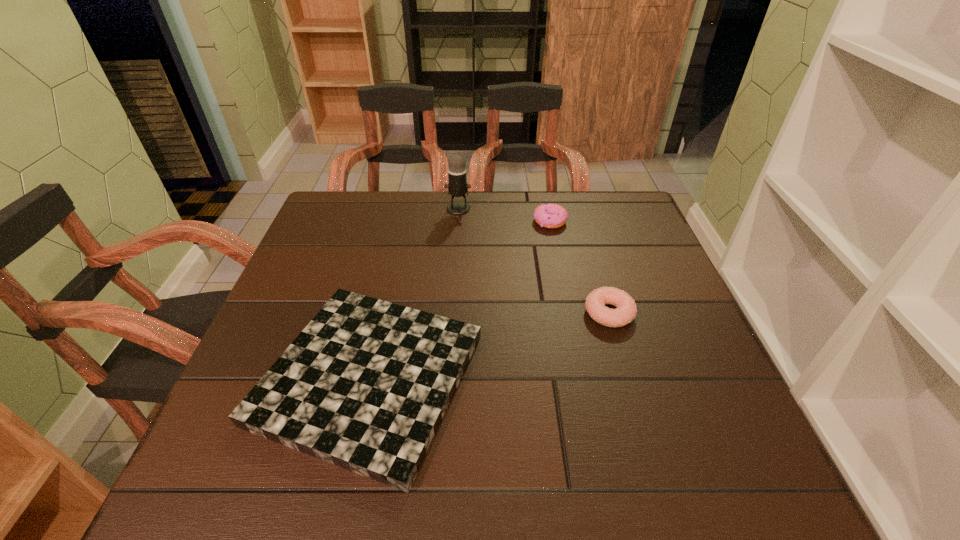
Find the location of a particular element. This screenshot has height=540, width=960. vacant space at the near right corner of the desktop is located at coordinates (720, 487).

Find the location of a particular element. free area in between the microphone and the nearer doughnut is located at coordinates (534, 261).

Identify the location of free space between the microphone and the checkerboard. (414, 293).

Find the location of `vacant point located between the microphone and the shortest object`. vacant point located between the microphone and the shortest object is located at coordinates (414, 293).

You are a GUI agent. You are given a task and a screenshot of the screen. Output one action in this format:
    pyautogui.click(x=<x>, y=<y>)
    Task: Click on the free space between the microphone and the checkerboard
    
    Given the screenshot: What is the action you would take?
    pyautogui.click(x=414, y=293)

The image size is (960, 540). I want to click on empty space that is in between the microphone and the nearer doughnut, so click(x=534, y=261).

Find the location of a particular element. This screenshot has width=960, height=540. free area in between the nearer doughnut and the farther doughnut is located at coordinates (580, 267).

At what (x,y) coordinates should I click in order to perform the action: click on free space between the checkerboard and the farther doughnut. Please return your answer as a coordinate pair (x, y). This screenshot has height=540, width=960. Looking at the image, I should click on (459, 300).

At what (x,y) coordinates should I click in order to perform the action: click on free point between the nearer doughnut and the tallest object. Please return your answer as a coordinate pair (x, y). The height and width of the screenshot is (540, 960). Looking at the image, I should click on [534, 261].

You are a GUI agent. You are given a task and a screenshot of the screen. Output one action in this format:
    pyautogui.click(x=<x>, y=<y>)
    Task: Click on the vacant space in between the nearer doughnut and the checkerboard
    
    Given the screenshot: What is the action you would take?
    click(489, 346)